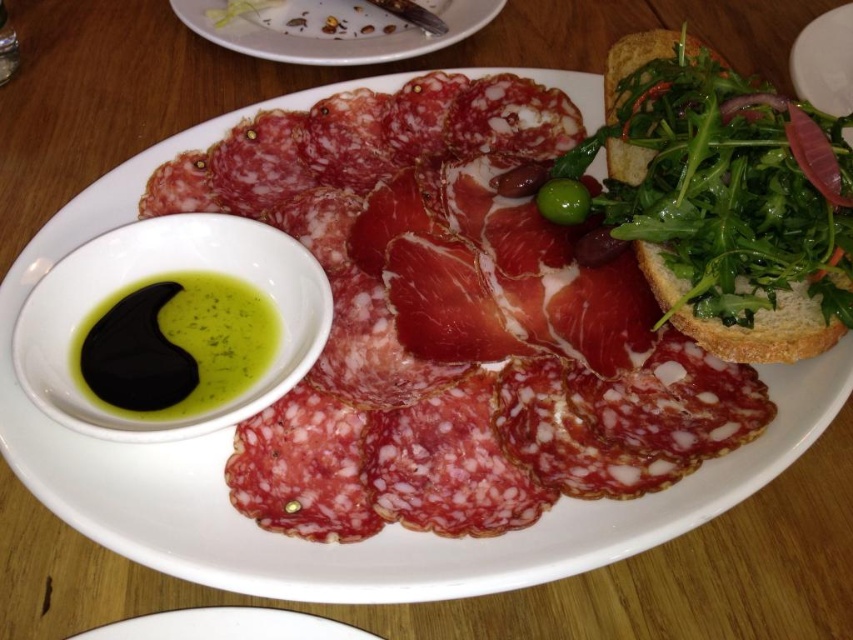
Where is `white ceramic plate at upper center`? white ceramic plate at upper center is located at coordinates (328, 28).

Can you confirm if white ceramic plate at upper center is positioned to the right of green glossy olive at upper center?

In fact, white ceramic plate at upper center is to the left of green glossy olive at upper center.

Who is more distant from viewer, [450,38] or [585,195]?

The point [450,38] is behind.

This screenshot has height=640, width=853. I want to click on white ceramic plate at upper center, so click(328, 28).

Between black oil at lower left and green glossy olive at upper center, which one has less height?

With less height is green glossy olive at upper center.

Can you confirm if black oil at lower left is thinner than green glossy olive at upper center?

In fact, black oil at lower left might be wider than green glossy olive at upper center.

Locate an element on the screen. Image resolution: width=853 pixels, height=640 pixels. black oil at lower left is located at coordinates [x=195, y=339].

This screenshot has height=640, width=853. I want to click on black oil at lower left, so click(195, 339).

Is point (608, 67) more distant than point (541, 186)?

Yes.

Who is more distant from viewer, (730, 342) or (572, 216)?

The point (572, 216) is more distant.

Identify the location of green leafy salad at upper right. (764, 332).